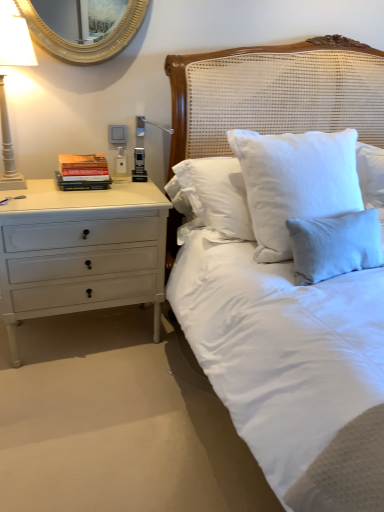
Describe the element at coordinates (81, 252) in the screenshot. I see `white painted wood chest of drawers at left` at that location.

You are a GUI agent. You are given a task and a screenshot of the screen. Output one action in this format:
    pyautogui.click(x=<x>, y=<y>)
    Task: Click on the white painted wood chest of drawers at left
    The image size is (384, 512).
    Given the screenshot: What is the action you would take?
    pyautogui.click(x=81, y=252)

What is the approximate width of hardcover books at left?

The width of hardcover books at left is 8.45 inches.

Where is `white woven headboard at upper center`? The width and height of the screenshot is (384, 512). white woven headboard at upper center is located at coordinates (274, 93).

What is the approximate width of light blue linen pillow at upper right?

light blue linen pillow at upper right is 5.62 inches in width.

The height and width of the screenshot is (512, 384). What do you see at coordinates (335, 245) in the screenshot?
I see `light blue linen pillow at upper right` at bounding box center [335, 245].

At what (x,y) coordinates should I click in order to perform the action: click on white painted wood chest of drawers at left. Please return your answer as a coordinate pair (x, y). The height and width of the screenshot is (512, 384). Looking at the image, I should click on (81, 252).

Does light blue linen pillow at upper right have a smaller size compared to white painted wood floor lamp at left?

Correct, light blue linen pillow at upper right occupies less space than white painted wood floor lamp at left.

At what (x,y) coordinates should I click in order to perform the action: click on bedside lamp positioned vertically above the light blue linen pillow at upper right (from a real-world perspective). Please return your answer as a coordinate pair (x, y). This screenshot has width=384, height=512. Looking at the image, I should click on (16, 42).

Considering the points (312, 268) and (9, 132), which point is behind, point (312, 268) or point (9, 132)?

The point (9, 132) is behind.

From the image's perspective, is light blue linen pillow at upper right beneath white painted wood floor lamp at left?

Yes, from the image's perspective, light blue linen pillow at upper right is beneath white painted wood floor lamp at left.

Do you think white painted wood floor lamp at left is within light blue linen pillow at upper right, or outside of it?

white painted wood floor lamp at left is located beyond the bounds of light blue linen pillow at upper right.

From a real-world perspective, is white painted wood floor lamp at left on light blue linen pillow at upper right?

Yes, from a real-world perspective, white painted wood floor lamp at left is above light blue linen pillow at upper right.

Between point (15, 41) and point (373, 242), which one is positioned in front?

The point (15, 41) is closer.

How many degrees apart are the facing directions of white painted wood floor lamp at left and white painted wood chest of drawers at left?

0.566 degrees.

Would you say white painted wood floor lamp at left is inside or outside white painted wood chest of drawers at left?

white painted wood floor lamp at left is not enclosed by white painted wood chest of drawers at left.

In the scene shown: Can you confirm if white painted wood floor lamp at left is thinner than white painted wood chest of drawers at left?

Yes, white painted wood floor lamp at left is thinner than white painted wood chest of drawers at left.

Is white painted wood floor lamp at left oriented towards white painted wood chest of drawers at left?

No.

Considering the sizes of objects gold metallic mirror at upper left and light blue linen pillow at upper right in the image provided, who is smaller, gold metallic mirror at upper left or light blue linen pillow at upper right?

Smaller between the two is gold metallic mirror at upper left.

You are a GUI agent. You are given a task and a screenshot of the screen. Output one action in this format:
    pyautogui.click(x=<x>, y=<y>)
    Task: Click on the mirror behind the light blue linen pillow at upper right
    This screenshot has width=384, height=512.
    Given the screenshot: What is the action you would take?
    83,27

What's the angular difference between gold metallic mirror at upper left and light blue linen pillow at upper right's facing directions?

gold metallic mirror at upper left and light blue linen pillow at upper right are facing 0.356 degrees away from each other.

Between point (108, 4) and point (306, 231), which one is positioned behind?

The point (108, 4) is behind.

From a real-world perspective, is white painted wood chest of drawers at left beneath gold metallic mirror at upper left?

Correct, in the physical world, white painted wood chest of drawers at left is lower than gold metallic mirror at upper left.

Between white painted wood chest of drawers at left and gold metallic mirror at upper left, which one has more height?

With more height is white painted wood chest of drawers at left.

Is white painted wood chest of drawers at left turned away from gold metallic mirror at upper left?

No, white painted wood chest of drawers at left's orientation is not away from gold metallic mirror at upper left.

In order to click on mirror on the right of white painted wood chest of drawers at left in this screenshot , I will do `click(83, 27)`.

Is point (107, 184) farther from viewer compared to point (0, 294)?

Yes, point (107, 184) is farther from viewer.

Looking at this image, what's the angular difference between hardcover books at left and white painted wood chest of drawers at left's facing directions?

There is a 0.566-degree angle between the facing directions of hardcover books at left and white painted wood chest of drawers at left.

Is hardcover books at left taller or shorter than white painted wood chest of drawers at left?

Clearly, hardcover books at left is shorter compared to white painted wood chest of drawers at left.

From a real-world perspective, is hardcover books at left physically below white painted wood chest of drawers at left?

Actually, hardcover books at left is physically above white painted wood chest of drawers at left in the real world.

Does point (112, 39) come closer to viewer compared to point (8, 130)?

Yes.

Consider the image. Is white painted wood floor lamp at left at the back of gold metallic mirror at upper left?

gold metallic mirror at upper left does not have its back to white painted wood floor lamp at left.

Considering the sizes of objects gold metallic mirror at upper left and white painted wood floor lamp at left in the image provided, who is wider, gold metallic mirror at upper left or white painted wood floor lamp at left?

white painted wood floor lamp at left is wider.

What's the angular difference between gold metallic mirror at upper left and white painted wood floor lamp at left's facing directions?

The angular difference between gold metallic mirror at upper left and white painted wood floor lamp at left is 4.73e-05 degrees.

You are a GUI agent. You are given a task and a screenshot of the screen. Output one action in this format:
    pyautogui.click(x=<x>, y=<y>)
    Task: Click on the pillow located underneath the white painted wood floor lamp at left (from a real-world perspective)
    The image size is (384, 512).
    Given the screenshot: What is the action you would take?
    pyautogui.click(x=335, y=245)

The height and width of the screenshot is (512, 384). What are the coordinates of `pillow located in front of the white painted wood floor lamp at left` in the screenshot? It's located at (335, 245).

Based on their spatial positions, is white painted wood floor lamp at left or white woven headboard at upper center further from light blue linen pillow at upper right?

white painted wood floor lamp at left.

Considering their positions, is white painted wood chest of drawers at left positioned further to gold metallic mirror at upper left than hardcover books at left?

white painted wood chest of drawers at left is positioned further to the anchor gold metallic mirror at upper left.

Based on their spatial positions, is white woven headboard at upper center or white painted wood floor lamp at left closer to hardcover books at left?

white painted wood floor lamp at left is positioned closer to the anchor hardcover books at left.

When comparing their distances from white painted wood floor lamp at left, does white painted wood chest of drawers at left or light blue linen pillow at upper right seem further?

light blue linen pillow at upper right is further to white painted wood floor lamp at left.

Considering their positions, is white painted wood floor lamp at left positioned closer to white woven headboard at upper center than light blue linen pillow at upper right?

The object closer to white woven headboard at upper center is light blue linen pillow at upper right.

From the image, which object appears to be farther from light blue linen pillow at upper right, hardcover books at left or white painted wood chest of drawers at left?

Based on the image, hardcover books at left appears to be further to light blue linen pillow at upper right.

When comparing their distances from white painted wood chest of drawers at left, does white painted wood floor lamp at left or gold metallic mirror at upper left seem further?

Based on the image, gold metallic mirror at upper left appears to be further to white painted wood chest of drawers at left.

Estimate the real-world distances between objects in this image. Which object is closer to hardcover books at left, white woven headboard at upper center or gold metallic mirror at upper left?

gold metallic mirror at upper left is closer to hardcover books at left.

Locate an element on the screen. The height and width of the screenshot is (512, 384). chest of drawers between white painted wood floor lamp at left and white woven headboard at upper center in the horizontal direction is located at coordinates (81, 252).

Locate an element on the screen. Image resolution: width=384 pixels, height=512 pixels. book between gold metallic mirror at upper left and white painted wood chest of drawers at left from top to bottom is located at coordinates point(82,172).

Locate an element on the screen. This screenshot has width=384, height=512. headboard located between white painted wood chest of drawers at left and light blue linen pillow at upper right in the left-right direction is located at coordinates (274, 93).

Where is `mirror situated between hardcover books at left and light blue linen pillow at upper right from left to right`? This screenshot has width=384, height=512. mirror situated between hardcover books at left and light blue linen pillow at upper right from left to right is located at coordinates (83, 27).